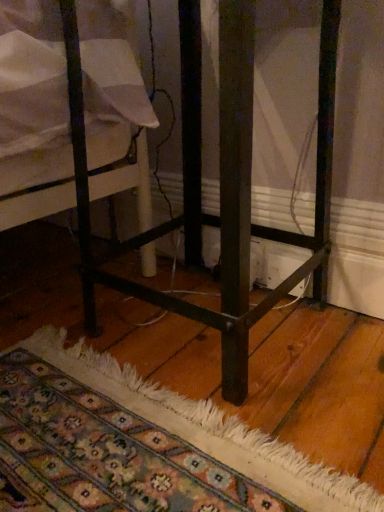
Where is `free spot to the left of metallic black bed frame at center`? The image size is (384, 512). free spot to the left of metallic black bed frame at center is located at coordinates (65, 332).